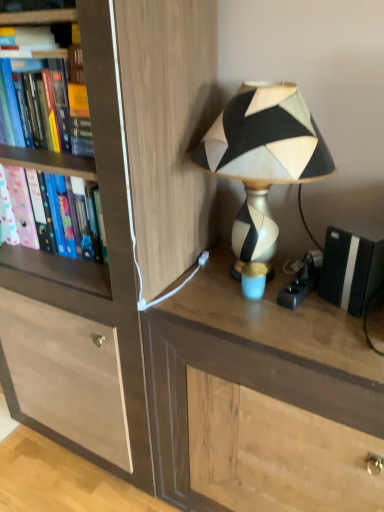
Question: From the image's perspective, is wooden cabinet at center positioned above or below pink matte folder at left, the 1th book when ordered from bottom to top?

Choices:
 (A) above
 (B) below

Answer: (B)

Question: From their relative heights in the image, would you say wooden cabinet at center is taller or shorter than pink matte folder at left, the second book when ordered from top to bottom?

Choices:
 (A) tall
 (B) short

Answer: (A)

Question: Which is farther from the black and white geometric lampshade at upper right?

Choices:
 (A) hardcover book at left, which is the second book in bottom-to-top order
 (B) black matte speaker at right
 (C) pink matte folder at left, the second book when ordered from top to bottom
 (D) wooden cabinet at center
 (E) brown wood desk at center

Answer: (C)

Question: Considering the real-world distances, which object is farthest from the black matte speaker at right?

Choices:
 (A) hardcover book at left, positioned as the 1th book in top-to-bottom order
 (B) pink matte folder at left, the second book when ordered from top to bottom
 (C) brown wood desk at center
 (D) black and white geometric lampshade at upper right
 (E) wooden cabinet at center

Answer: (B)